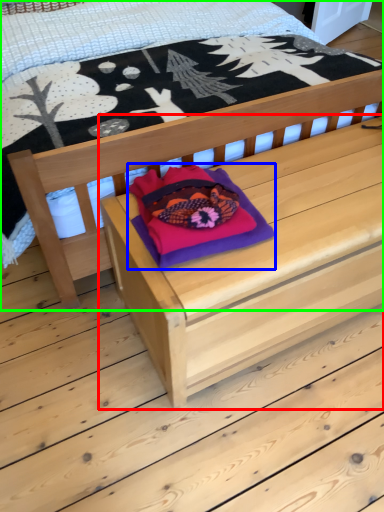
Question: Estimate the real-world distances between objects in this image. Which object is closer to table (highlighted by a red box), throw pillow (highlighted by a blue box) or bed (highlighted by a green box)?

Choices:
 (A) throw pillow
 (B) bed

Answer: (A)